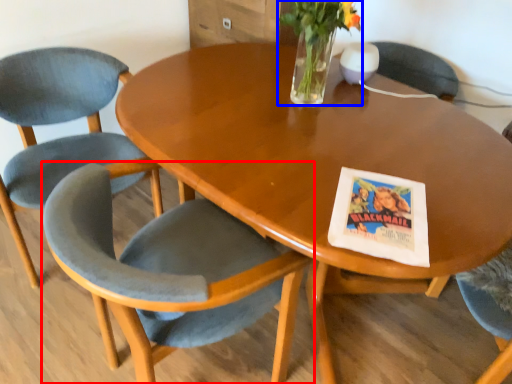
Question: Which point is further to the camera, chair (highlighted by a red box) or floral arrangement (highlighted by a blue box)?

Choices:
 (A) chair
 (B) floral arrangement

Answer: (B)